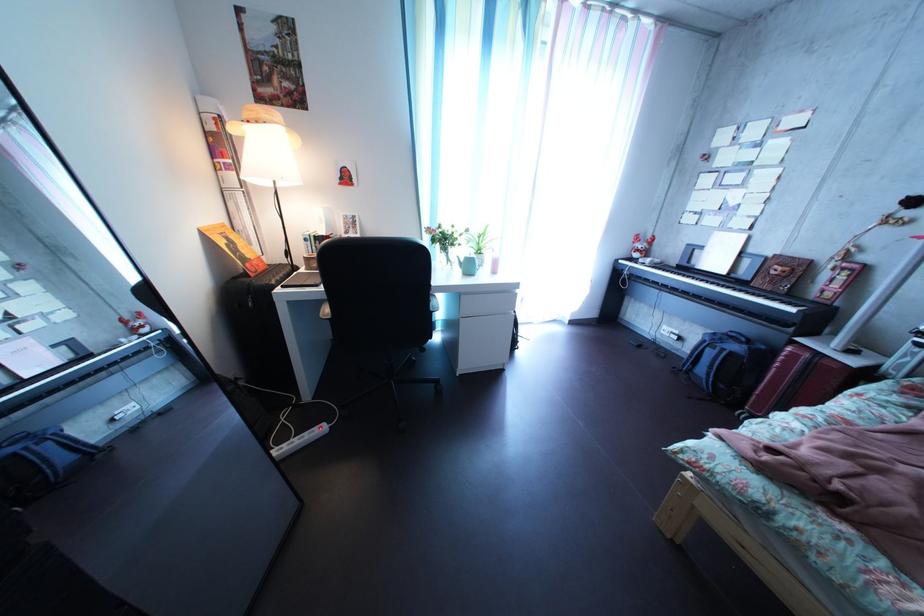
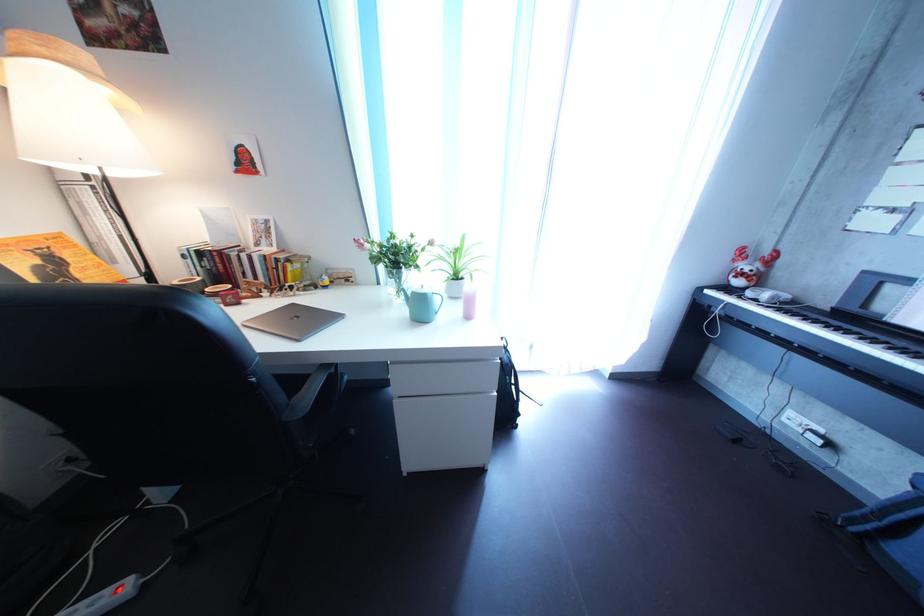
Where in the second image is the point corresponding to point 483,275 from the first image?

(433, 315)